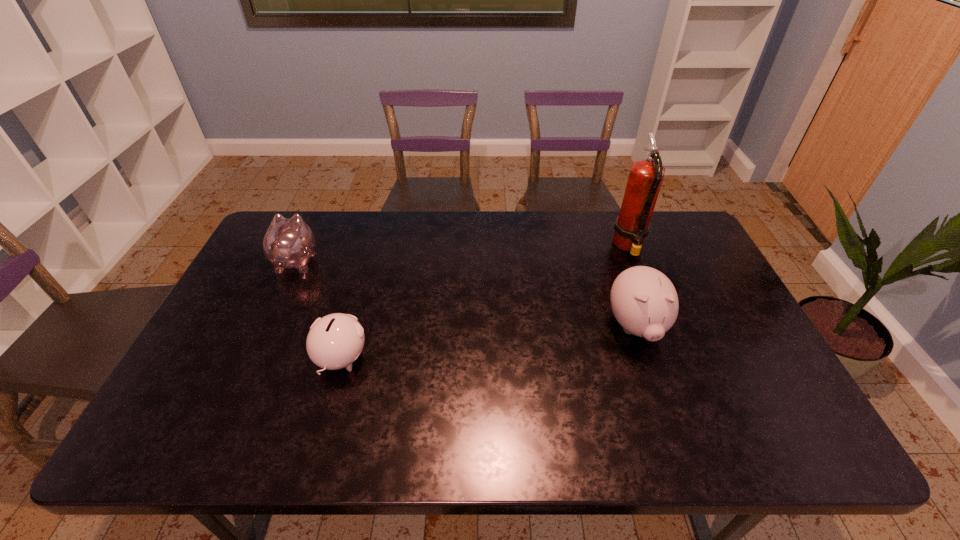
Image resolution: width=960 pixels, height=540 pixels. Find the location of `object that stands as the third closest to the fire extinguisher`. object that stands as the third closest to the fire extinguisher is located at coordinates (288, 243).

Identify which object is the third closest to the leftmost piggy bank. Please provide its 2D coordinates. Your answer should be formatted as a tuple, i.e. [(x, y)], where the tuple contains the x and y coordinates of a point satisfying the conditions above.

[(632, 225)]

Where is `piggy bank that can be found as the third closest to the fire extinguisher`? The width and height of the screenshot is (960, 540). piggy bank that can be found as the third closest to the fire extinguisher is located at coordinates (288, 243).

Where is `the second closest piggy bank to the shortest object`? the second closest piggy bank to the shortest object is located at coordinates (644, 301).